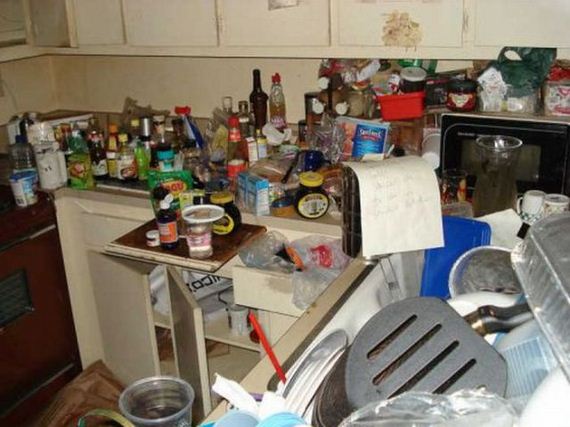
Where is `cabinet shelf`? Image resolution: width=570 pixels, height=427 pixels. cabinet shelf is located at coordinates tap(218, 330).